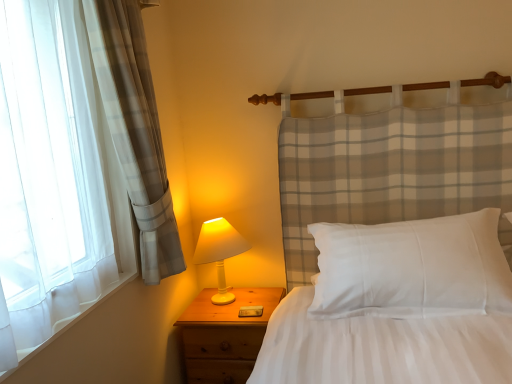
Question: Does white matte table lamp at lower left have a lesser width compared to wooden nightstand at lower left?

Choices:
 (A) no
 (B) yes

Answer: (B)

Question: Is white matte table lamp at lower left taller than wooden nightstand at lower left?

Choices:
 (A) yes
 (B) no

Answer: (B)

Question: Is white matte table lamp at lower left closer to the viewer compared to wooden nightstand at lower left?

Choices:
 (A) yes
 (B) no

Answer: (B)

Question: From a real-world perspective, is white matte table lamp at lower left on wooden nightstand at lower left?

Choices:
 (A) no
 (B) yes

Answer: (B)

Question: Is white matte table lamp at lower left not close to wooden nightstand at lower left?

Choices:
 (A) yes
 (B) no

Answer: (B)

Question: Relative to white cotton pillow at center, is wooden nightstand at lower left in front or behind?

Choices:
 (A) front
 (B) behind

Answer: (B)

Question: Looking at their shapes, would you say wooden nightstand at lower left is wider or thinner than white cotton pillow at center?

Choices:
 (A) wide
 (B) thin

Answer: (A)

Question: Is wooden nightstand at lower left to the left or to the right of white cotton pillow at center in the image?

Choices:
 (A) left
 (B) right

Answer: (A)

Question: Is wooden nightstand at lower left taller or shorter than white cotton pillow at center?

Choices:
 (A) short
 (B) tall

Answer: (B)

Question: Looking at the image, does white matte table lamp at lower left seem bigger or smaller compared to white cotton pillow at center?

Choices:
 (A) small
 (B) big

Answer: (A)

Question: From a real-world perspective, is white matte table lamp at lower left positioned above or below white cotton pillow at center?

Choices:
 (A) below
 (B) above

Answer: (A)

Question: Does point (206, 241) appear closer or farther from the camera than point (444, 231)?

Choices:
 (A) closer
 (B) farther

Answer: (B)

Question: Is white matte table lamp at lower left taller or shorter than white cotton pillow at center?

Choices:
 (A) tall
 (B) short

Answer: (A)

Question: Visually, is white cotton pillow at center positioned to the left or to the right of white matte table lamp at lower left?

Choices:
 (A) left
 (B) right

Answer: (B)

Question: From their relative heights in the image, would you say white cotton pillow at center is taller or shorter than white matte table lamp at lower left?

Choices:
 (A) tall
 (B) short

Answer: (B)